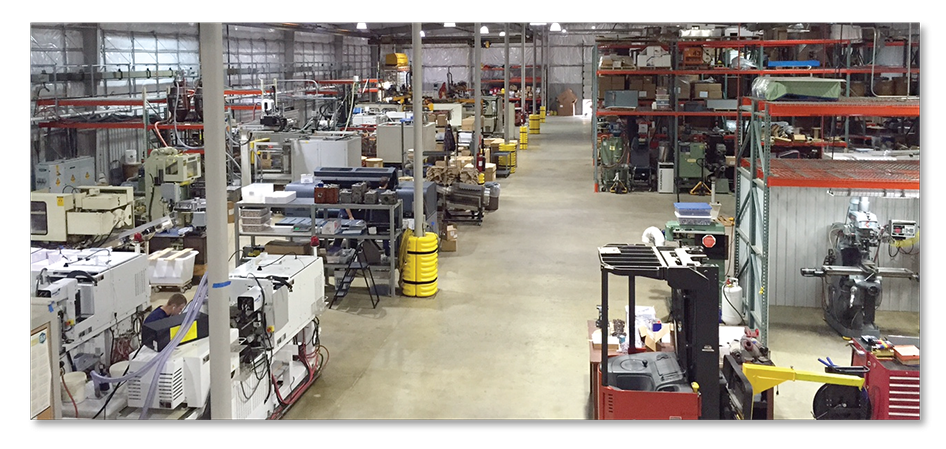
Where is `shelves`? The height and width of the screenshot is (449, 946). shelves is located at coordinates (285, 223), (342, 228), (268, 254), (324, 259), (299, 201), (348, 203).